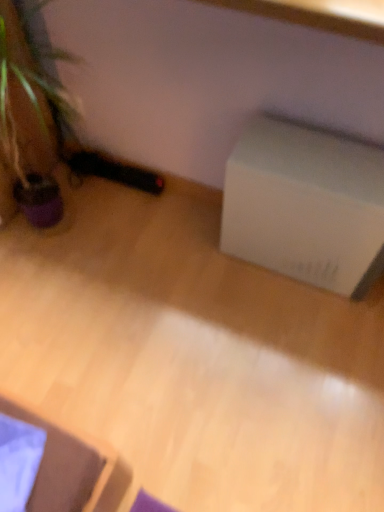
Where is `vacant region to the left of white matte box at lower right`? The image size is (384, 512). vacant region to the left of white matte box at lower right is located at coordinates (190, 265).